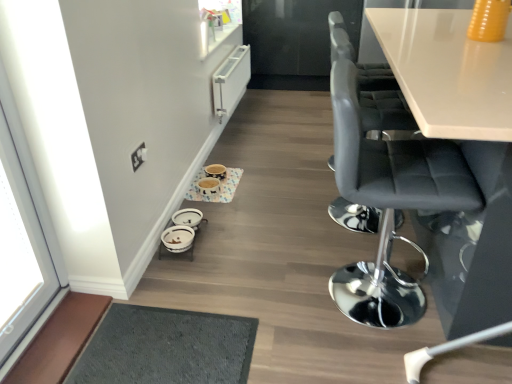
The image size is (512, 384). Identify the location of free space to the left of black leather stool at right, the second chair positioned from the back. (275, 294).